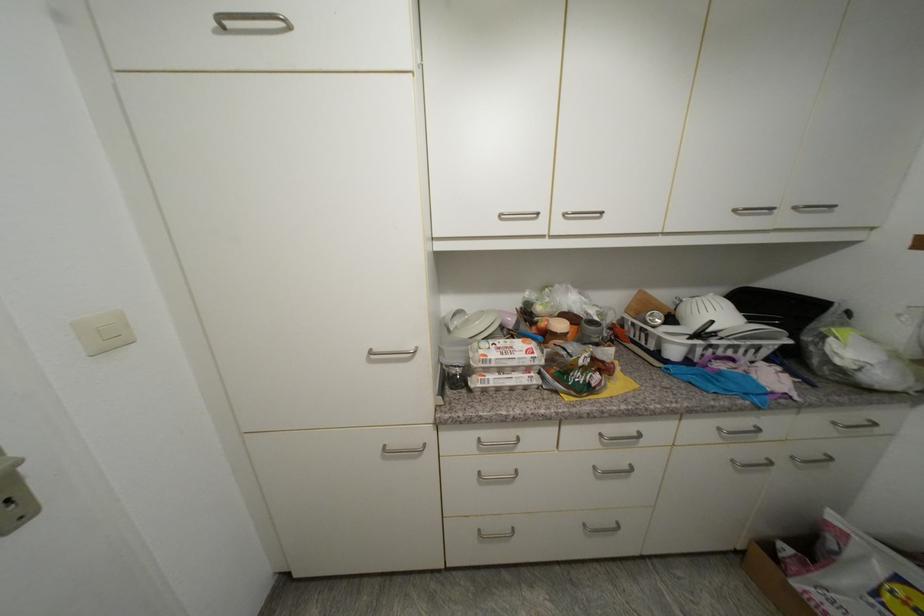
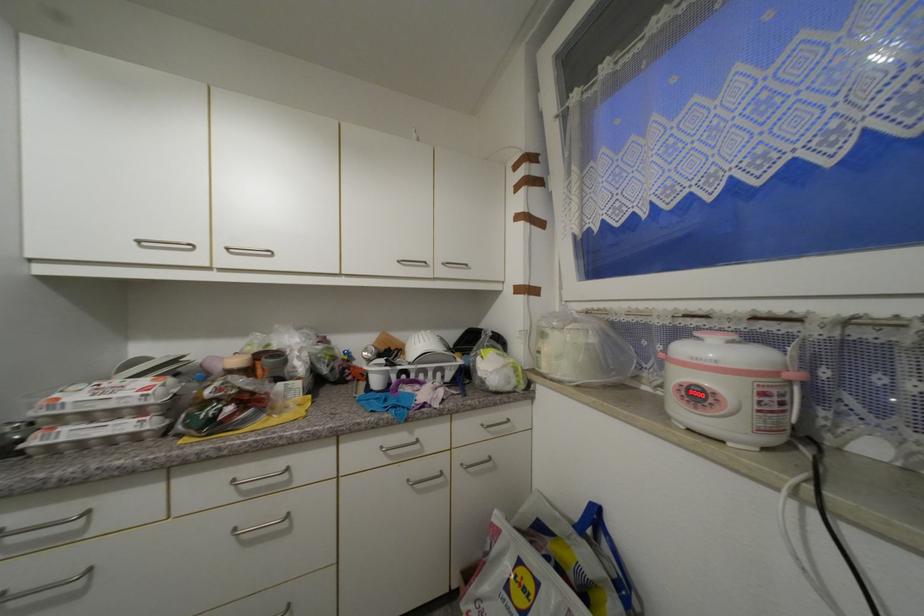
Locate, in the second image, the point that corresponds to point (800, 209) in the first image.

(448, 265)